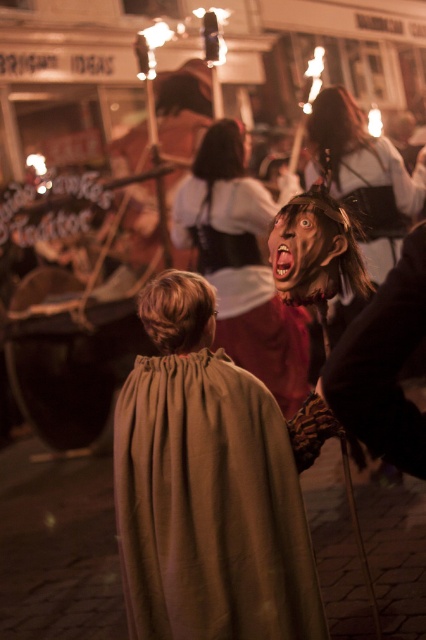
You are standing in the middle of the cobblestone street and see the smooth brown mask at center. If you walk straight ahead, will you walk into the mask?

The smooth brown mask at center is positioned at point 0.519 on the x axis and 0.615 on the y axis. Since you are standing in the middle of the cobblestone street, which would be at coordinate 0.5 on both axes, the mask is slightly to your right and ahead of you. Therefore, walking straight ahead might not directly lead you into the mask, but you should be cautious as it is in your general path.

What is located at the point with coordinates (x=210, y=506)?

The point with coordinates (x=210, y=506) is on the brown cotton cape at center.